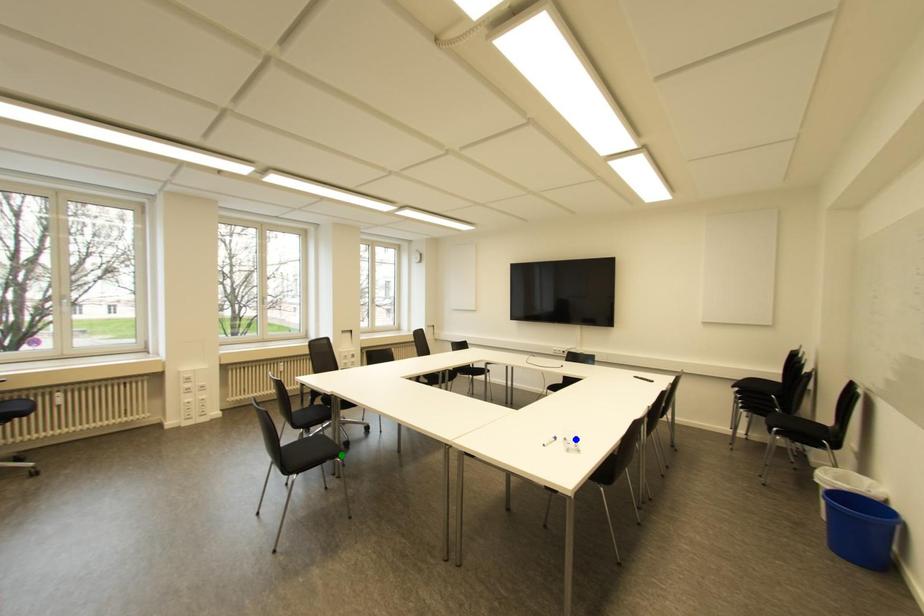
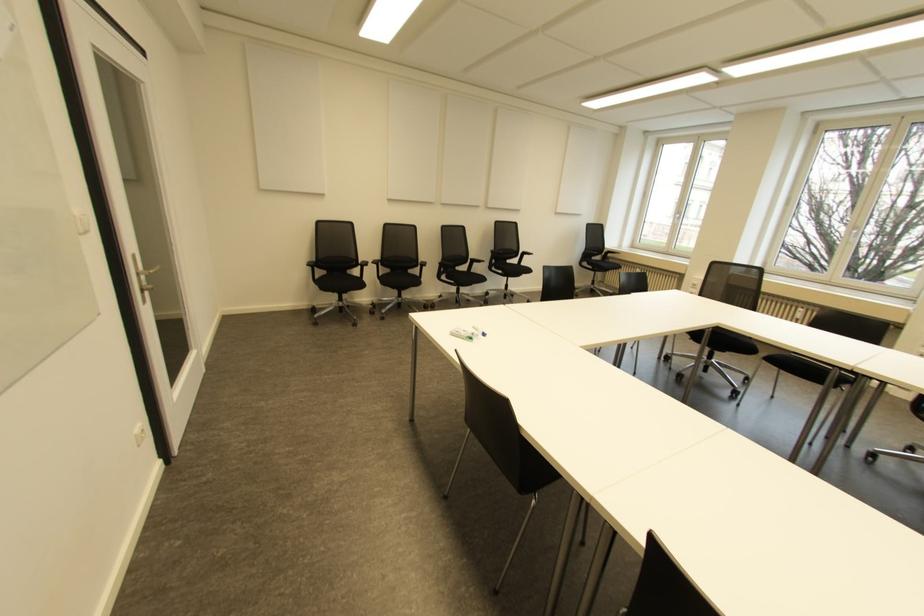
I am providing you with two images of the same scene from different viewpoints. Three points are marked in image1. Which point corresponds to a part or object that is occluded in image2?In image1, three points are marked. Which of them correspond to a part or object that is occluded in image2?Among the three points shown in image1, which one corresponds to a part or object that is no longer visible due to occlusion in image2?

Invisible in image2: green point.